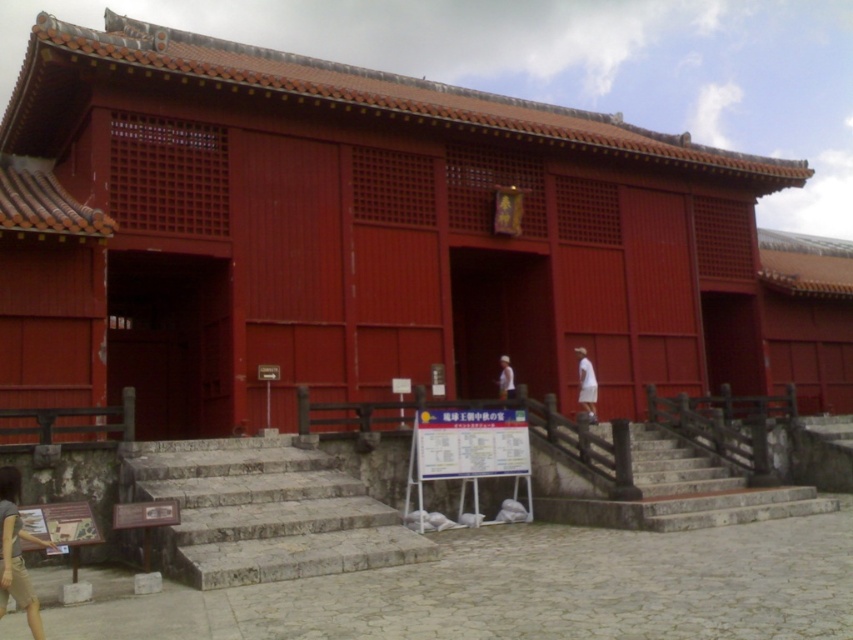
Question: Among these objects, which one is farthest from the camera?

Choices:
 (A) stone/stained at center
 (B) gray stone stairs at lower left

Answer: (A)

Question: Does stone/stained at center appear under white fabric at right?

Choices:
 (A) yes
 (B) no

Answer: (A)

Question: Does gray stone stairs at lower left have a smaller size compared to white fabric at right?

Choices:
 (A) no
 (B) yes

Answer: (A)

Question: Which object is positioned closest to the matte red wood temple at center?

Choices:
 (A) white fabric at right
 (B) gray stone stairs at lower left
 (C) white fabric shirt at center

Answer: (A)

Question: Can you confirm if matte red wood temple at center is bigger than white fabric at right?

Choices:
 (A) no
 (B) yes

Answer: (B)

Question: Which point appears farthest from the camera in this image?

Choices:
 (A) (502, 385)
 (B) (567, 321)
 (C) (209, 579)

Answer: (B)